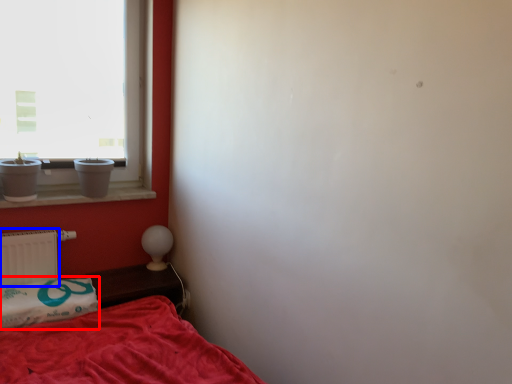
Question: Among these objects, which one is farthest to the camera, pillow (highlighted by a red box) or radiator (highlighted by a blue box)?

Choices:
 (A) pillow
 (B) radiator

Answer: (B)